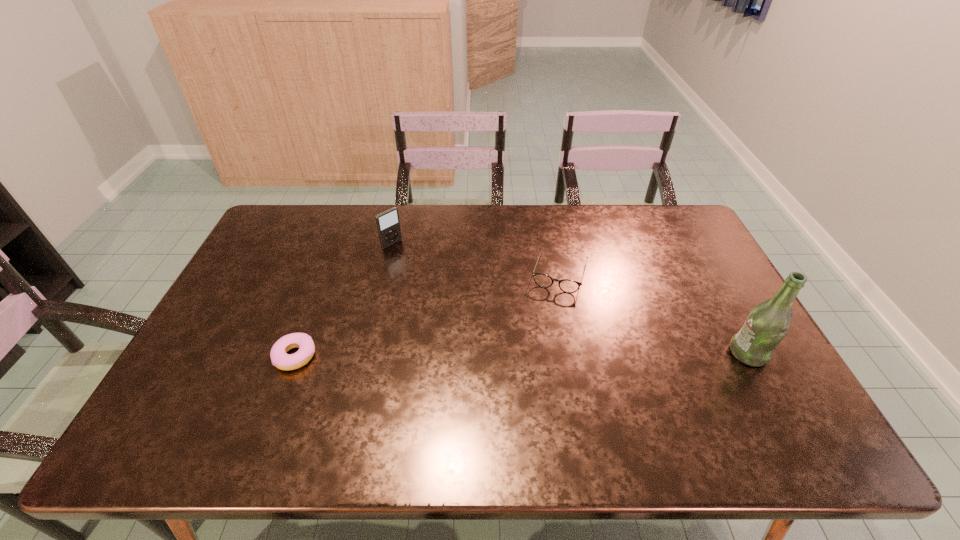
Find the location of `vacant point located between the third tallest object and the shortest object`. vacant point located between the third tallest object and the shortest object is located at coordinates (428, 314).

The image size is (960, 540). In order to click on free space between the third object from right to left and the shortest object in this screenshot , I will do `click(344, 300)`.

I want to click on unoccupied position between the doughnut and the spectacles, so click(x=428, y=314).

The image size is (960, 540). Find the location of `object that can be found as the third closest to the beer bottle`. object that can be found as the third closest to the beer bottle is located at coordinates (279, 357).

This screenshot has width=960, height=540. Identify the location of the closest object relative to the shortest object. (388, 224).

Where is `vacant point that satisfies the following two spatial constraints: 1. on the front side of the second farthest object; 2. on the surface of the rightmost object`? vacant point that satisfies the following two spatial constraints: 1. on the front side of the second farthest object; 2. on the surface of the rightmost object is located at coordinates click(x=576, y=353).

Where is `free space that satisfies the following two spatial constraints: 1. on the front side of the rightmost object; 2. on the surface of the iPod`? The image size is (960, 540). free space that satisfies the following two spatial constraints: 1. on the front side of the rightmost object; 2. on the surface of the iPod is located at coordinates (367, 353).

Find the location of a particular element. The height and width of the screenshot is (540, 960). free space that satisfies the following two spatial constraints: 1. on the back side of the shortest object; 2. on the right side of the second shortest object is located at coordinates (327, 273).

You are a GUI agent. You are given a task and a screenshot of the screen. Output one action in this format:
    pyautogui.click(x=<x>, y=<y>)
    Task: Click on the blank space that satisfies the following two spatial constraints: 1. on the front side of the second tallest object; 2. on the left side of the spectacles
    The image size is (960, 540).
    Given the screenshot: What is the action you would take?
    pyautogui.click(x=385, y=273)

Where is `free space that satisfies the following two spatial constraints: 1. on the front side of the beer bottle; 2. on the surface of the second object from right to left`? free space that satisfies the following two spatial constraints: 1. on the front side of the beer bottle; 2. on the surface of the second object from right to left is located at coordinates (576, 353).